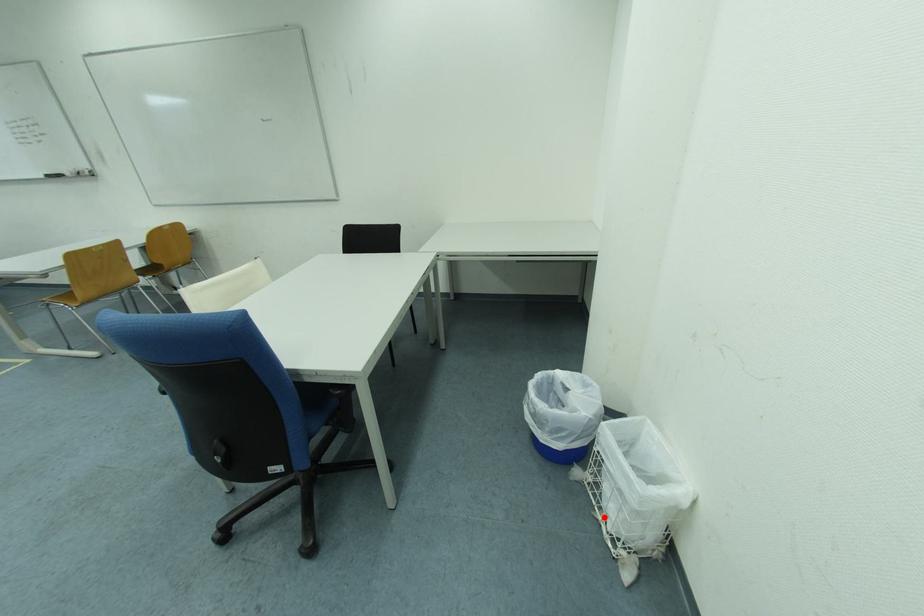
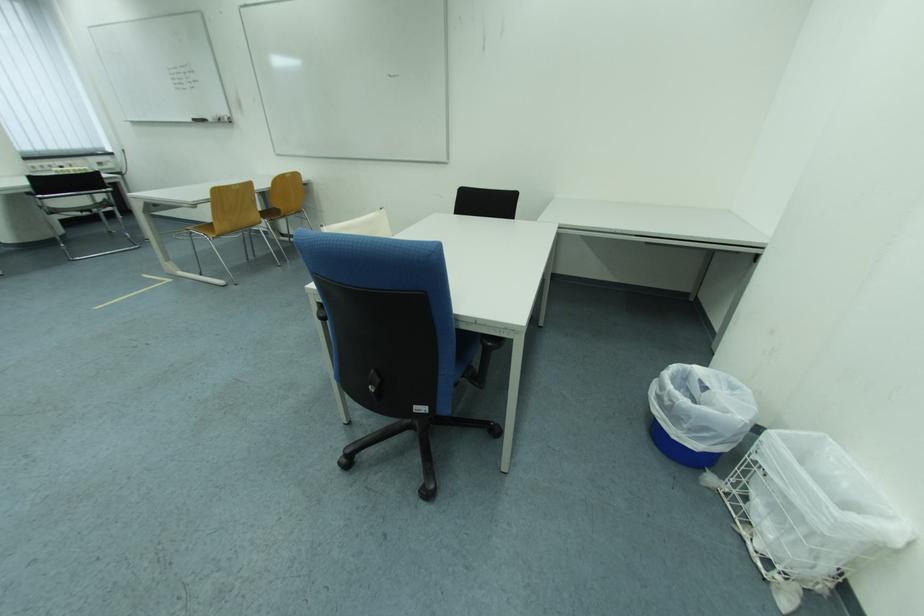
Question: I am providing you with two images of the same scene from different viewpoints. A red point is marked on the first image. Is the red point's position out of view in image 2?

Choices:
 (A) Yes
 (B) No

Answer: (B)